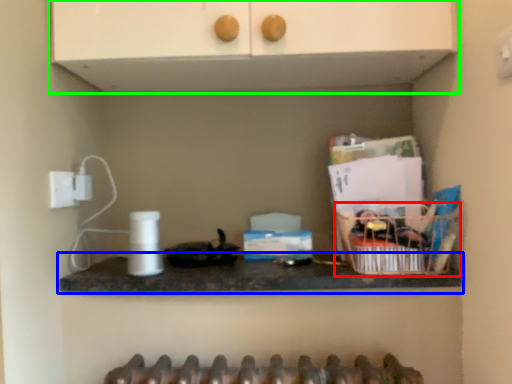
Question: Considering the real-world distances, which object is closest to basket (highlighted by a red box)? countertop (highlighted by a blue box) or cabinetry (highlighted by a green box).

Choices:
 (A) countertop
 (B) cabinetry

Answer: (A)